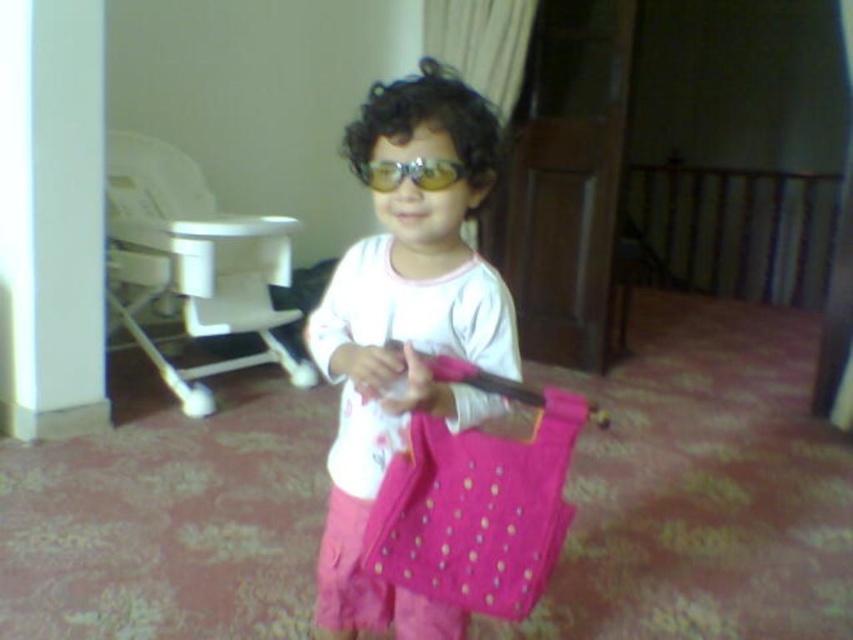
You are a toy designer who needs to create a storage box for a child. The storage box must fit both the matte pink fabric at center and the yellow reflective lenses at center without overlapping. What is the minimum length required for the box in centimeters?

The minimum length required for the box should be at least 22.14 centimeters to accommodate the distance between the matte pink fabric at center and the yellow reflective lenses at center without overlapping.

The child is holding a bag with two distinct features. Which object is positioned to the left of the other when looking at the matte pink fabric at center and the yellow reflective lenses at center?

The matte pink fabric at center is to the left of the yellow reflective lenses at center.

The child is holding a bright pink bag with small light dots. Where exactly is the matte pink fabric at center located in the image?

The matte pink fabric at center is located at point (x=405, y=332).